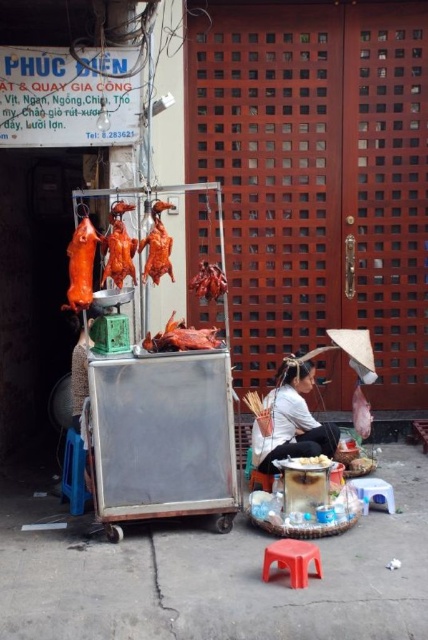
Please describe the position of the point labeled as point [291,420] in the scene.

The point labeled as point [291,420] represents the location of the matte brown hair at center.

You are a customer standing in front of the street food vendor stall. You see the matte brown hair at center and the red plastic stool at lower center. Which object is located to the right when viewed from your perspective?

The matte brown hair at center is positioned on the right side of the red plastic stool at lower center, so from your perspective as a customer standing in front of the stall, the matte brown hair at center is to the right of the red plastic stool at lower center.